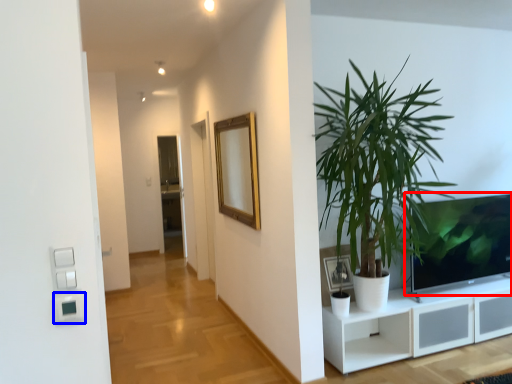
Question: Which object appears closest to the camera in this image, television (highlighted by a red box) or light switch (highlighted by a blue box)?

Choices:
 (A) television
 (B) light switch

Answer: (B)